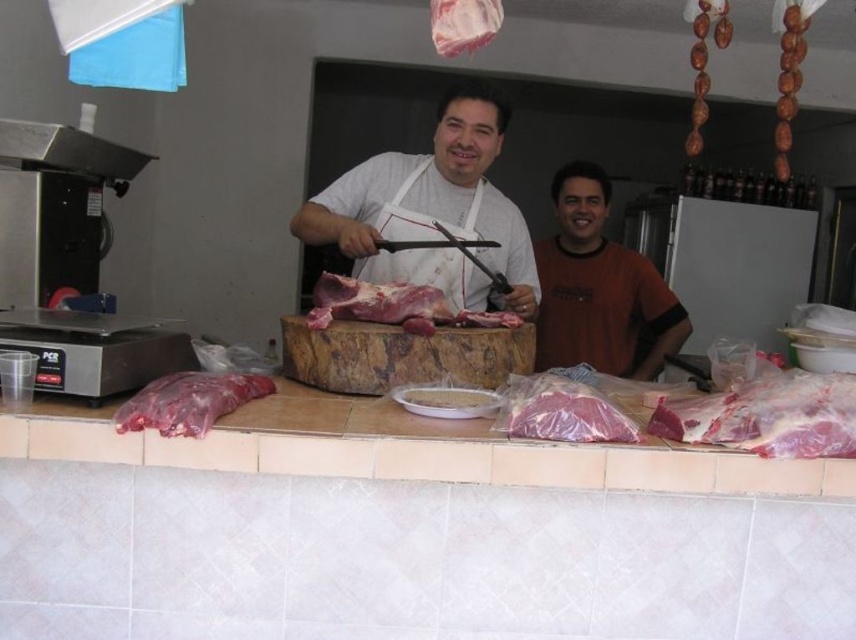
Consider the image. You are a customer at the butcher shop and want to buy the pinkish translucent meat at center and the raw pink meat at center. The store has a height restriction for packaging. Which meat would require a taller container?

The raw pink meat at center requires a taller container because it has a greater height than the pinkish translucent meat at center.

You are a customer in the butcher shop and want to place an order. You see two pieces of meat on the counter. The pinkish raw meat at right and the raw pink meat at center. How far apart are these two pieces of meat?

The distance between the pinkish raw meat at right and the raw pink meat at center is 24.55 inches.

In the scene shown: You are a customer at the butcher shop and want to know which meat is more visible to you. The pinkish translucent meat at center and the raw pink meat at center are both on the counter. Which one is closer to you?

The pinkish translucent meat at center is closer to the viewer than the raw pink meat at center, so it is more visible.